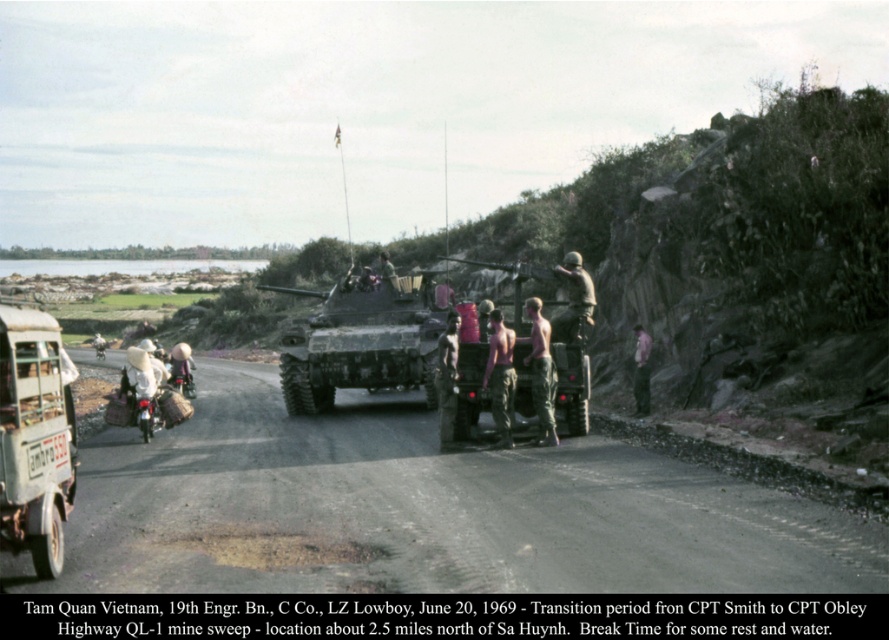
Question: Is camouflage paint tank at center thinner than rusty metal truck at lower left?

Choices:
 (A) yes
 (B) no

Answer: (B)

Question: Can you confirm if camouflage paint tank at center is positioned to the left of pink fabric shirt at center-right?

Choices:
 (A) no
 (B) yes

Answer: (B)

Question: Where is skinny man at center located in relation to white fabric hat at left in the image?

Choices:
 (A) right
 (B) left

Answer: (A)

Question: Which of the following is the farthest from the observer?

Choices:
 (A) (173, 364)
 (B) (351, 385)

Answer: (A)

Question: Which of the following is the closest to the observer?

Choices:
 (A) white fabric hat at left
 (B) camouflage pants at center
 (C) white cloth hat at left

Answer: (B)

Question: Which of the following is the closest to the observer?

Choices:
 (A) white cloth hat at left
 (B) white fabric hat at left

Answer: (A)